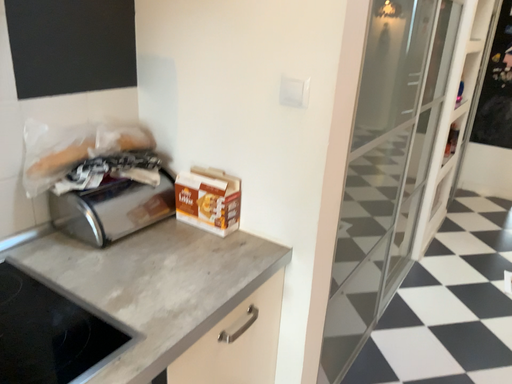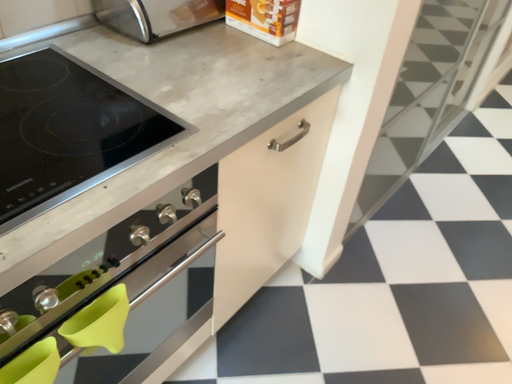
Question: How did the camera likely rotate when shooting the video?

Choices:
 (A) rotated upward
 (B) rotated downward

Answer: (B)